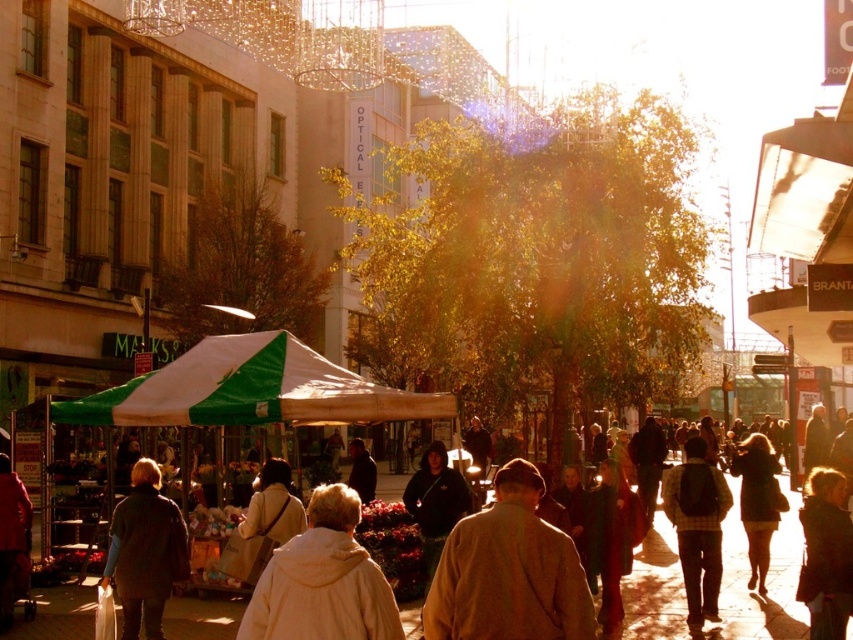
You are a customer browsing clothing items displayed in an outdoor market stall. You see a brown woolen coat at center and a plaid shirt at center. Which item is positioned lower on the display?

The brown woolen coat at center is positioned below the plaid shirt at center, so it is lower on the display.

You are standing in the urban street scene and want to determine which of the two points, point [491,508] or point [689,456], is nearer to you. Based on the scene description, which point is closer?

Point [491,508] is closer to the viewer than point [689,456].